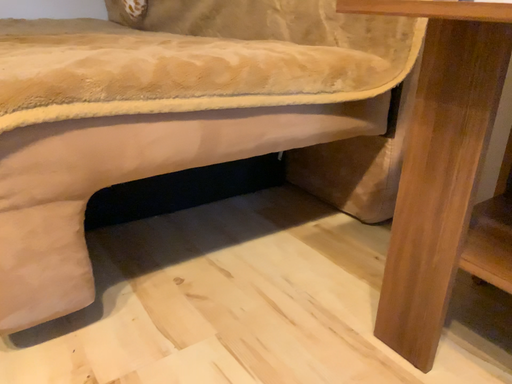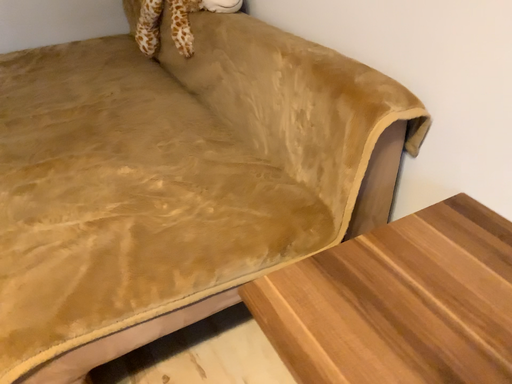
Question: Which way did the camera rotate in the video?

Choices:
 (A) rotated right
 (B) rotated left

Answer: (B)